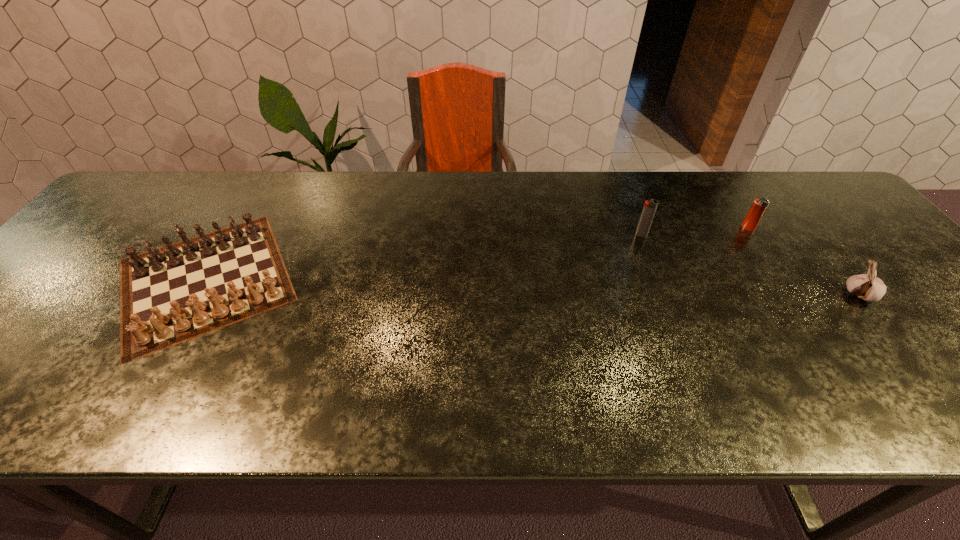
The width and height of the screenshot is (960, 540). Find the location of `object located in the far edge section of the desktop`. object located in the far edge section of the desktop is located at coordinates (188, 285).

At what (x,y) coordinates should I click in order to perform the action: click on object positioned at the left edge. Please return your answer as a coordinate pair (x, y). Looking at the image, I should click on (188, 285).

Identify the location of object at the right edge. This screenshot has height=540, width=960. (868, 287).

At what (x,y) coordinates should I click in order to perform the action: click on object that is at the far left corner. Please return your answer as a coordinate pair (x, y). Looking at the image, I should click on (188, 285).

Image resolution: width=960 pixels, height=540 pixels. I want to click on vacant space at the far edge of the desktop, so click(573, 195).

Image resolution: width=960 pixels, height=540 pixels. In the image, there is a desktop. What are the coordinates of `free space at the near edge` in the screenshot? It's located at (442, 385).

At what (x,y) coordinates should I click in order to perform the action: click on vacant space at the right edge of the desktop. Please return your answer as a coordinate pair (x, y). The image size is (960, 540). Looking at the image, I should click on (913, 292).

Identify the location of vacant space at the far left corner. (112, 211).

This screenshot has width=960, height=540. In the image, there is a desktop. What are the coordinates of `free space at the far right corner` in the screenshot? It's located at (819, 190).

You are a GUI agent. You are given a task and a screenshot of the screen. Output one action in this format:
    pyautogui.click(x=<x>, y=<y>)
    Task: Click on the free spot between the second object from left to right and the rightmost object
    
    Given the screenshot: What is the action you would take?
    pyautogui.click(x=751, y=265)